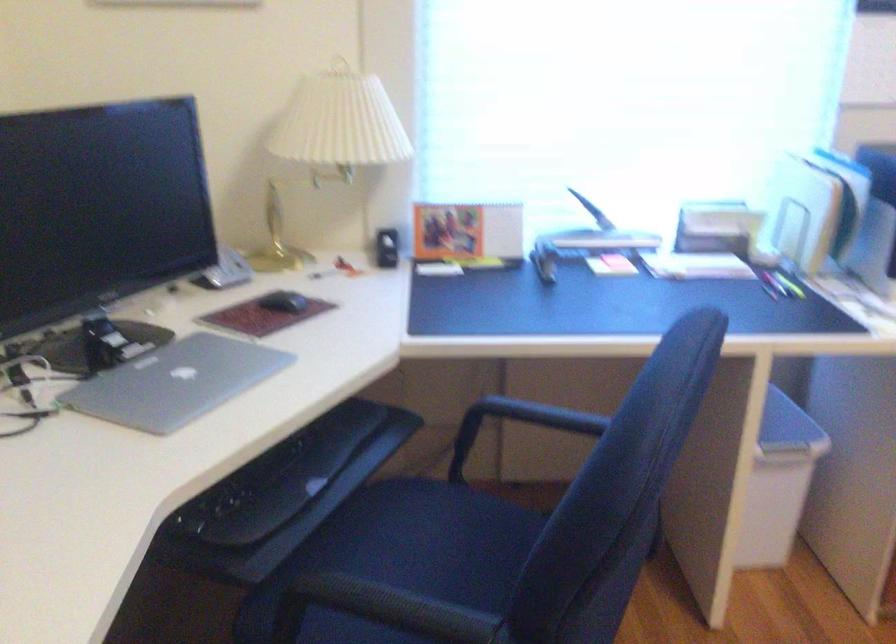
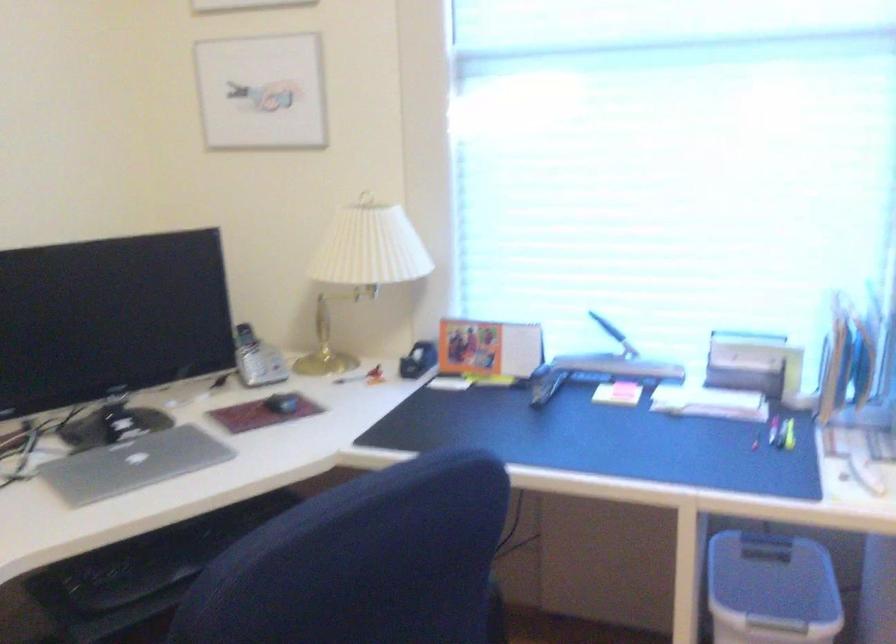
Question: In a continuous first-person perspective shot, in which direction is the camera moving?

Choices:
 (A) Left
 (B) Right
 (C) Forward
 (D) Backward

Answer: (B)